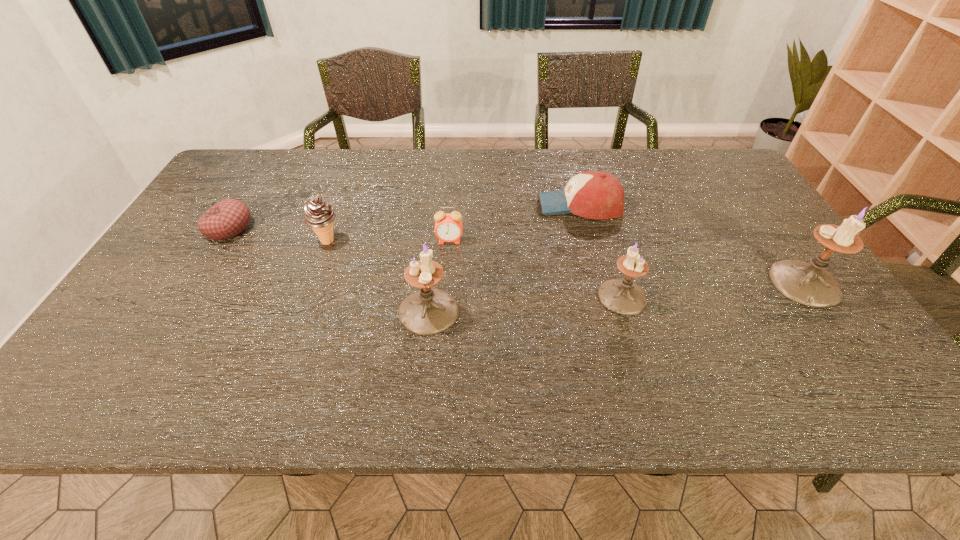
Find the location of a particular element. The height and width of the screenshot is (540, 960). vacant space located 0.160m on the right of the shortest candle holder is located at coordinates (712, 296).

Where is `free space located 0.060m on the back of the rightmost candle holder`? The image size is (960, 540). free space located 0.060m on the back of the rightmost candle holder is located at coordinates tap(778, 245).

Image resolution: width=960 pixels, height=540 pixels. What are the coordinates of `free space located on the front-facing side of the baseball cap` in the screenshot? It's located at (492, 205).

At what (x,y) coordinates should I click in order to perform the action: click on vacant region located 0.150m on the front-facing side of the baseball cap. Please return your answer as a coordinate pair (x, y). The width and height of the screenshot is (960, 540). Looking at the image, I should click on (489, 205).

This screenshot has width=960, height=540. What are the coordinates of `free space located on the front-facing side of the baseball cap` in the screenshot? It's located at (471, 205).

The width and height of the screenshot is (960, 540). Find the location of `free region located 0.180m on the face of the alarm clock`. free region located 0.180m on the face of the alarm clock is located at coordinates (445, 294).

Identify the location of free region located on the right of the icecream. This screenshot has width=960, height=540. (429, 241).

Where is `vacant space situated on the front of the shortest object`? This screenshot has height=540, width=960. vacant space situated on the front of the shortest object is located at coordinates pyautogui.click(x=194, y=284).

You are a GUI agent. You are given a task and a screenshot of the screen. Output one action in this format:
    pyautogui.click(x=<x>, y=<y>)
    Task: Click on the object situated at the near edge
    The height and width of the screenshot is (540, 960).
    Given the screenshot: What is the action you would take?
    pyautogui.click(x=430, y=311)

What are the coordinates of `object that is at the left edge` in the screenshot? It's located at (228, 218).